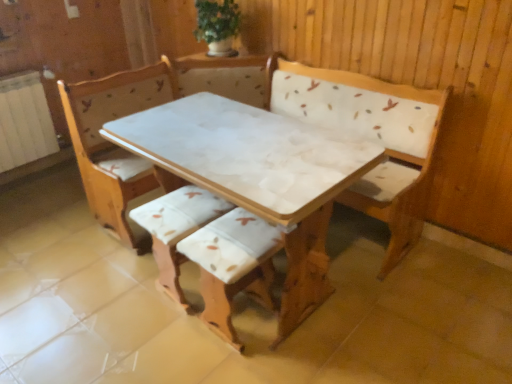
I want to click on free location above white marble table at center (from a real-world perspective), so click(x=228, y=145).